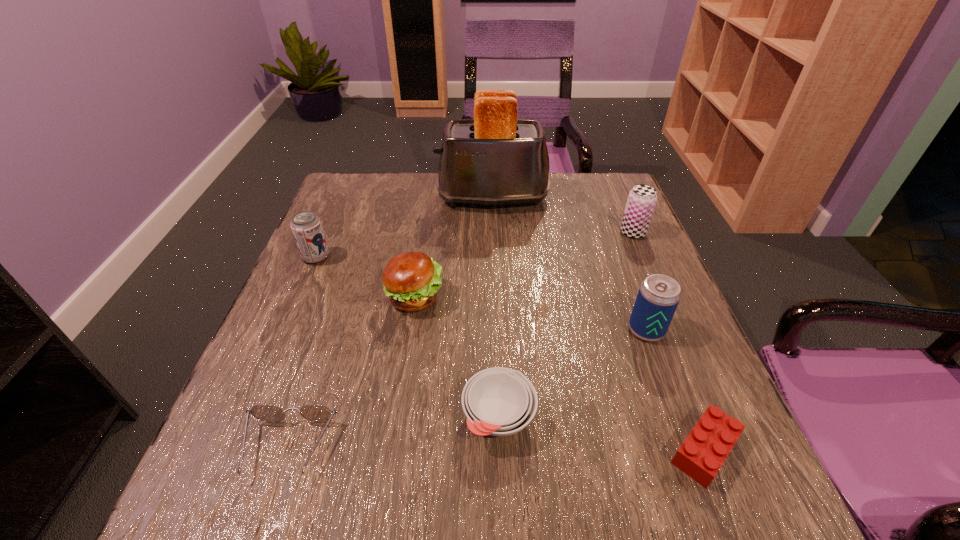
Where is `free region that satisfies the following two spatial constraints: 1. on the front side of the leftmost beer can; 2. on the right side of the nearest beer can`? free region that satisfies the following two spatial constraints: 1. on the front side of the leftmost beer can; 2. on the right side of the nearest beer can is located at coordinates (284, 330).

Identify the location of blank space that satisfies the following two spatial constraints: 1. on the side of the farthest beer can with the control lever; 2. on the right side of the tallest object. Image resolution: width=960 pixels, height=540 pixels. (493, 233).